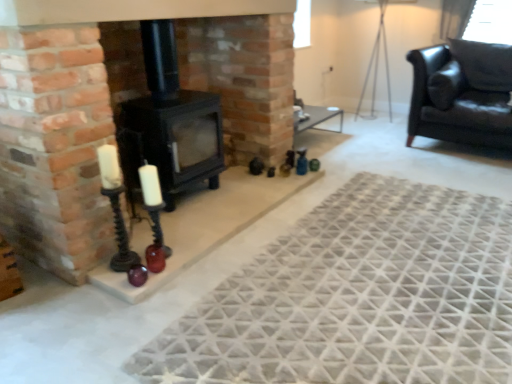
Identify the location of free space to the left of black glass candle holder at lower left, placed as the 1th candle holder when sorted from right to left. (135, 250).